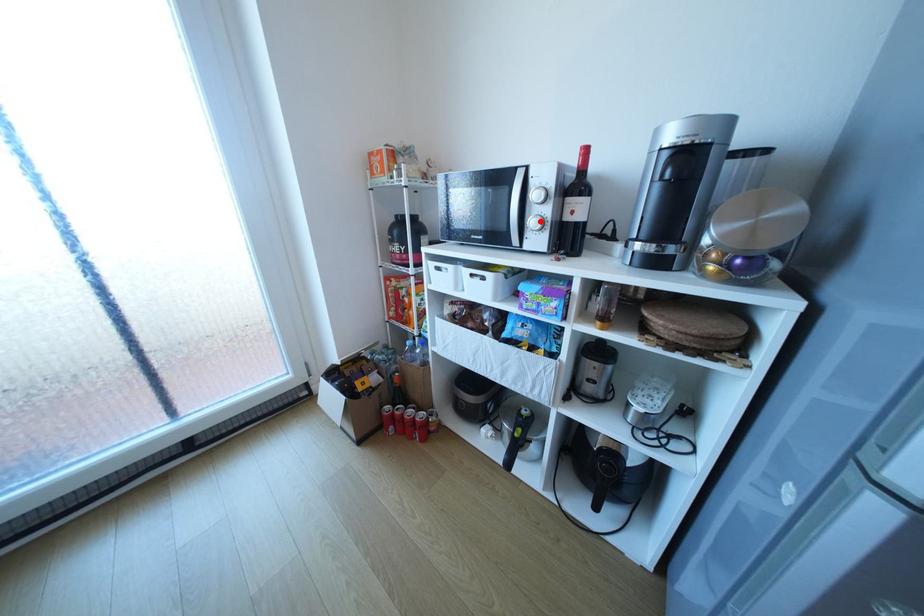
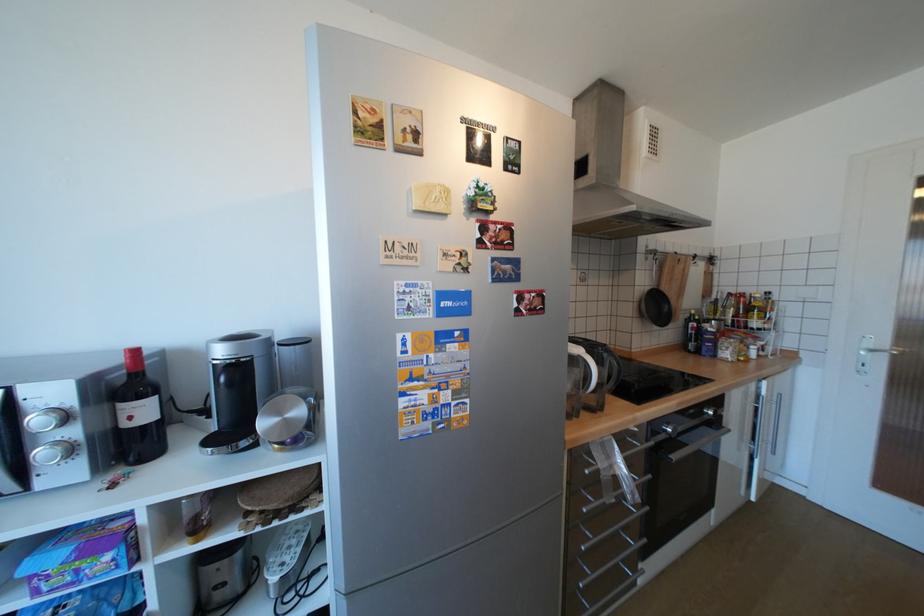
Locate, in the second image, the point that corresponds to the highlighted location in the first image.

(52, 453)